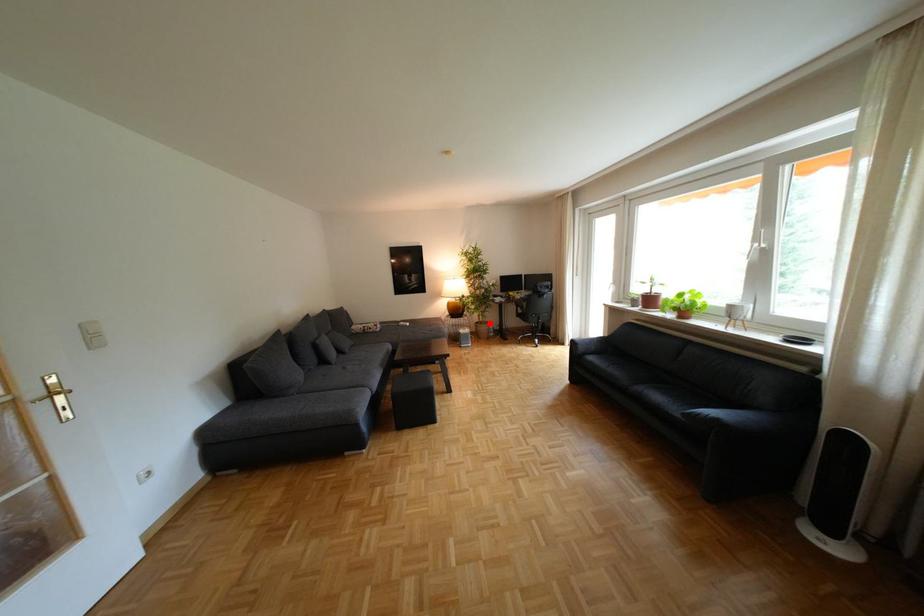
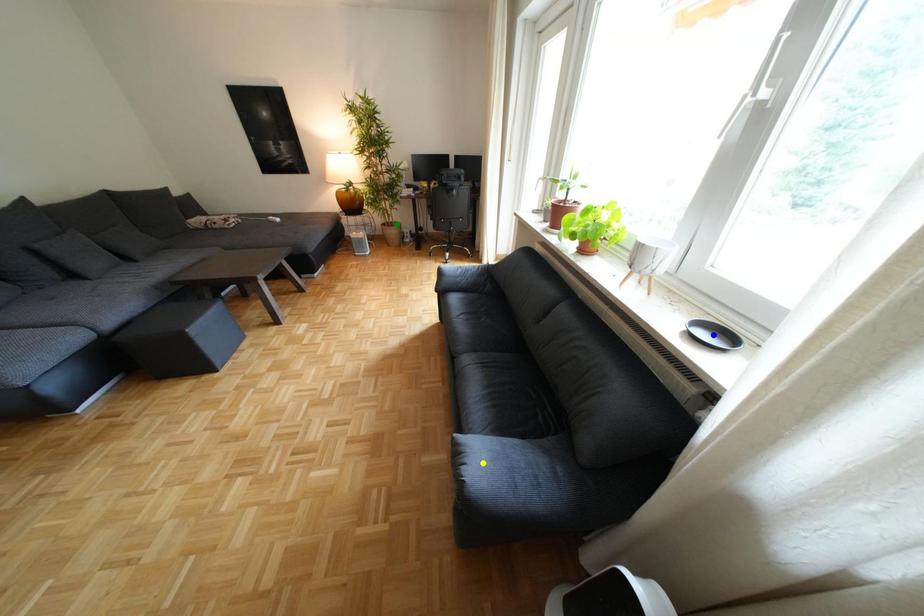
Question: I am providing you with two images of the same scene from different viewpoints. A red point is marked on the first image. You are given multiple points on the second image. Can you choose the point in image 2 that corresponds to the point in image 1?

Choices:
 (A) yellow point
 (B) green point
 (C) blue point

Answer: (B)